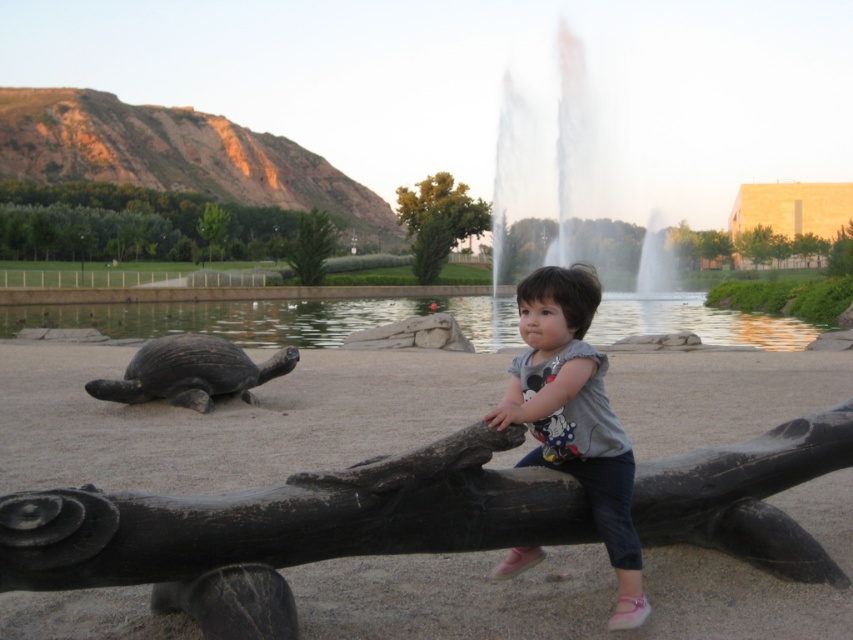
Who is taller, matte gray shirt at center or dark brown textured tortoise at left?

matte gray shirt at center

Between point (529, 342) and point (207, 394), which one is positioned in front?

Point (529, 342) is more forward.

At what (x,y) coordinates should I click in order to perform the action: click on matte gray shirt at center. Please return your answer as a coordinate pair (x, y). This screenshot has width=853, height=640. Looking at the image, I should click on (575, 416).

Who is more forward, [148,573] or [618,620]?

Point [148,573] is in front.

Is point (683, 477) farther from viewer compared to point (630, 499)?

Yes, it is.

At what (x,y) coordinates should I click in order to perform the action: click on smooth dark wood log at center. Please return your answer as a coordinate pair (x, y). Image resolution: width=853 pixels, height=640 pixels. Looking at the image, I should click on (292, 518).

Can you confirm if smooth dark wood log at center is positioned to the right of transparent glass water at upper center?

In fact, smooth dark wood log at center is to the left of transparent glass water at upper center.

Between smooth dark wood log at center and transparent glass water at upper center, which one appears on the left side from the viewer's perspective?

smooth dark wood log at center

Which is in front, point (688, 541) or point (534, 113)?

Point (688, 541) is in front.

This screenshot has height=640, width=853. I want to click on smooth dark wood log at center, so click(292, 518).